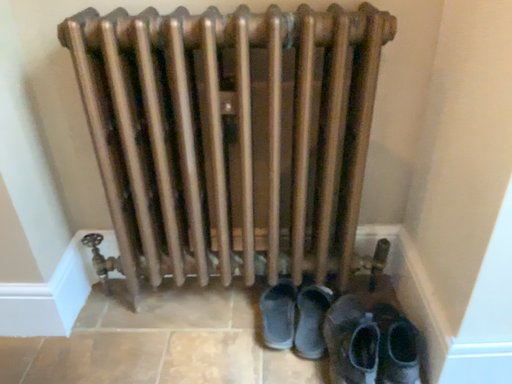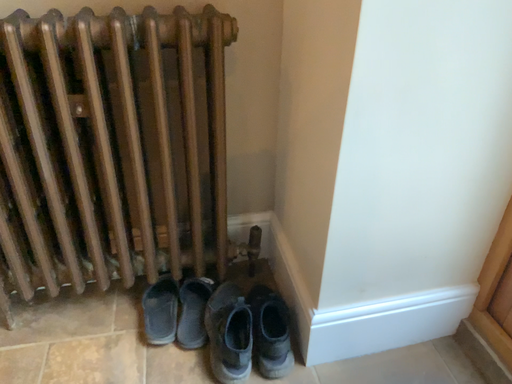
Question: How did the camera likely rotate when shooting the video?

Choices:
 (A) rotated left
 (B) rotated right

Answer: (B)